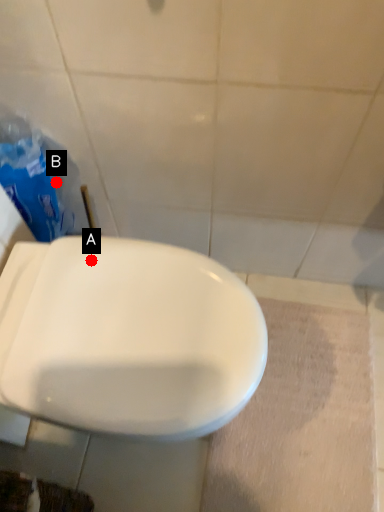
Question: Two points are circled on the image, labeled by A and B beside each circle. Which point is closer to the camera taking this photo?

Choices:
 (A) A is closer
 (B) B is closer

Answer: (A)